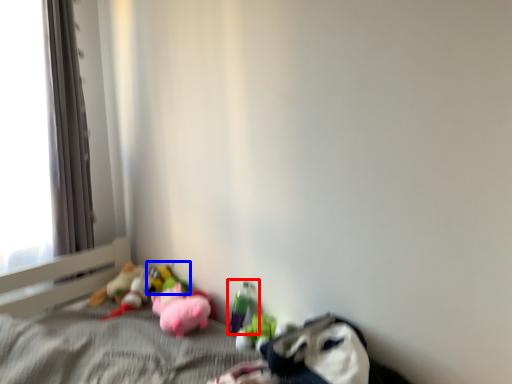
Question: Among these objects, which one is nearest to the camera, toy (highlighted by a red box) or toy (highlighted by a blue box)?

Choices:
 (A) toy
 (B) toy

Answer: (A)